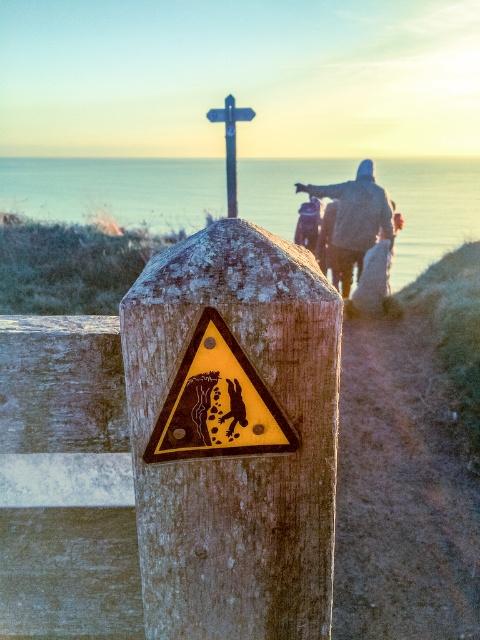
This screenshot has width=480, height=640. What are the coordinates of `weathered wood post at center` in the screenshot? It's located at (233, 435).

Does weathered wood post at center have a greater height compared to metallic blue signpost at upper center?

No, weathered wood post at center is not taller than metallic blue signpost at upper center.

Who is more distant from viewer, (261, 330) or (232, 180)?

The point (232, 180) is behind.

The height and width of the screenshot is (640, 480). What are the coordinates of `weathered wood post at center` in the screenshot? It's located at (233, 435).

Is yellow matte warning sign at center wider than gray woolen sweater at upper right?

Incorrect, yellow matte warning sign at center's width does not surpass gray woolen sweater at upper right's.

Can you confirm if yellow matte warning sign at center is positioned to the right of gray woolen sweater at upper right?

No, yellow matte warning sign at center is not to the right of gray woolen sweater at upper right.

In the scene shown: Who is more forward, (228, 348) or (362, 176)?

Positioned in front is point (228, 348).

The image size is (480, 640). What are the coordinates of `yellow matte warning sign at center` in the screenshot? It's located at [217, 403].

Can you confirm if gray woolen sweater at upper right is wider than metallic blue signpost at upper center?

Yes.

Does gray woolen sweater at upper right have a larger size compared to metallic blue signpost at upper center?

Incorrect, gray woolen sweater at upper right is not larger than metallic blue signpost at upper center.

This screenshot has width=480, height=640. Describe the element at coordinates (356, 218) in the screenshot. I see `gray woolen sweater at upper right` at that location.

I want to click on gray woolen sweater at upper right, so click(x=356, y=218).